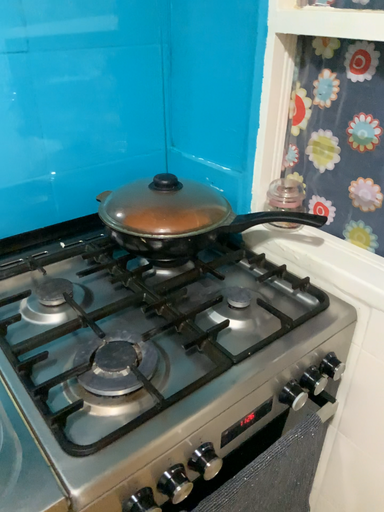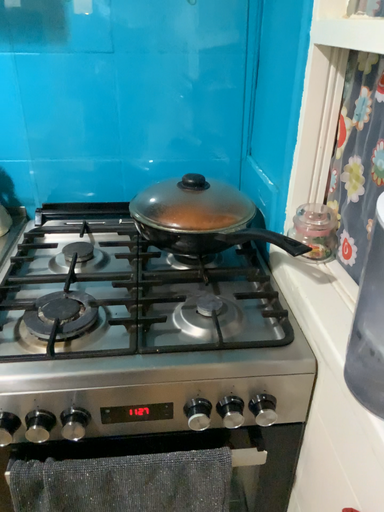
Question: Which way did the camera rotate in the video?

Choices:
 (A) rotated downward
 (B) rotated upward

Answer: (B)